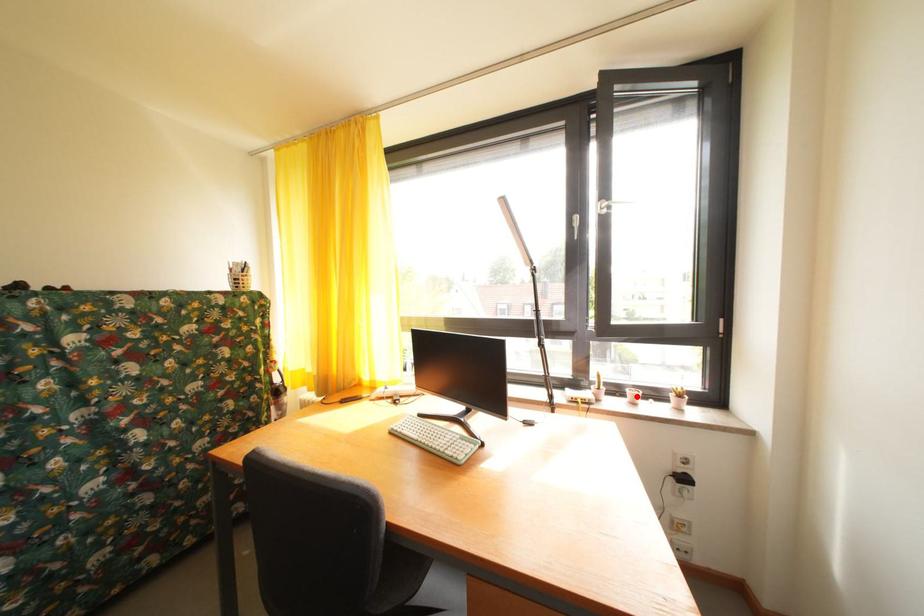
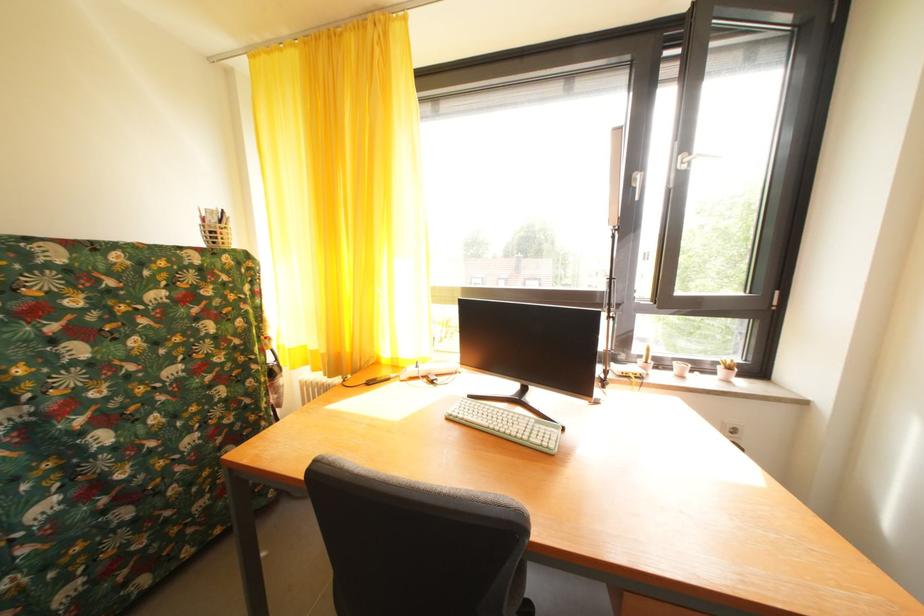
The point at the highlighted location is marked in the first image. Where is the corresponding point in the second image?

(685, 370)